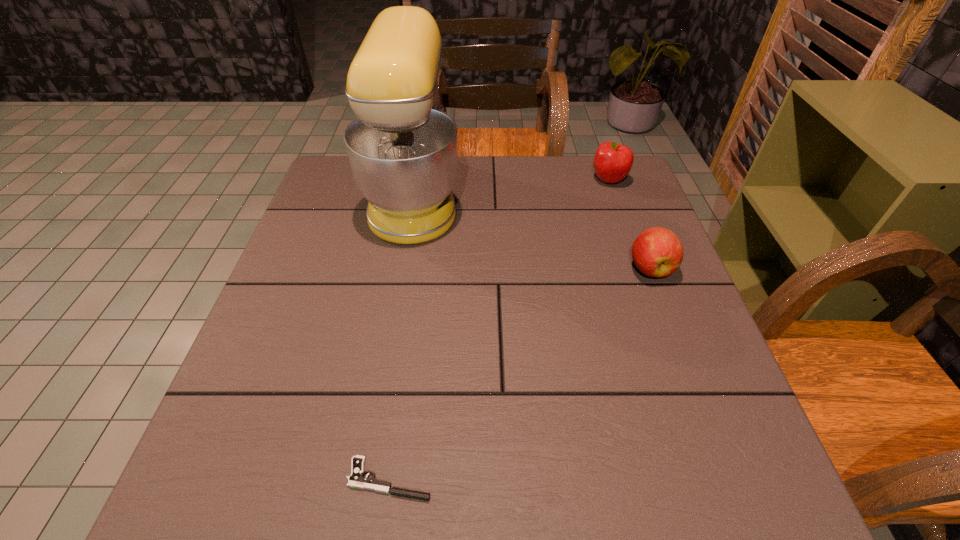
Locate an element on the screen. The image size is (960, 540). free spot between the third farthest object and the nearest object is located at coordinates (520, 374).

Locate an element on the screen. empty space between the farther apple and the nearer apple is located at coordinates (630, 224).

I want to click on vacant region between the farther apple and the shortest object, so click(499, 329).

Choose which object is the nearest neighbor to the shortest object. Please provide its 2D coordinates. Your answer should be formatted as a tuple, i.e. [(x, y)], where the tuple contains the x and y coordinates of a point satisfying the conditions above.

[(403, 149)]

Locate an element on the screen. object that is the second closest to the tallest object is located at coordinates (657, 252).

Identify the location of free space that satisfies the following two spatial constraints: 1. on the front side of the farther apple; 2. on the front-facing side of the pistol. (715, 479).

Locate an element on the screen. This screenshot has width=960, height=540. vacant space that satisfies the following two spatial constraints: 1. on the front side of the farther apple; 2. on the side of the tallest object with the control knob is located at coordinates (614, 196).